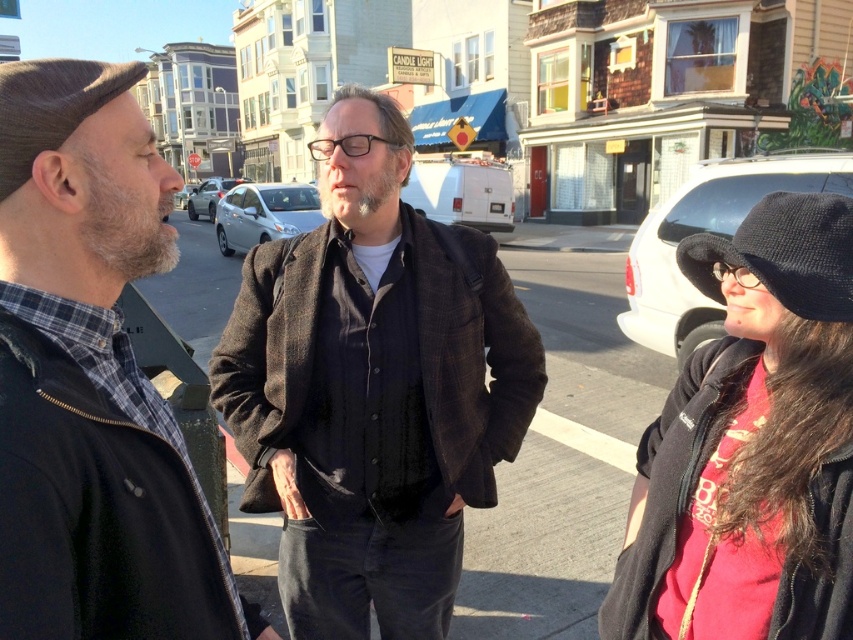
You are a photographer standing at the center of the street. You want to take a photo of the black knit hat at right. Where should you aim your camera to capture it?

You should aim your camera at the point with coordinates 0.397 on the x axis and 0.919 on the y axis to capture the black knit hat at right.